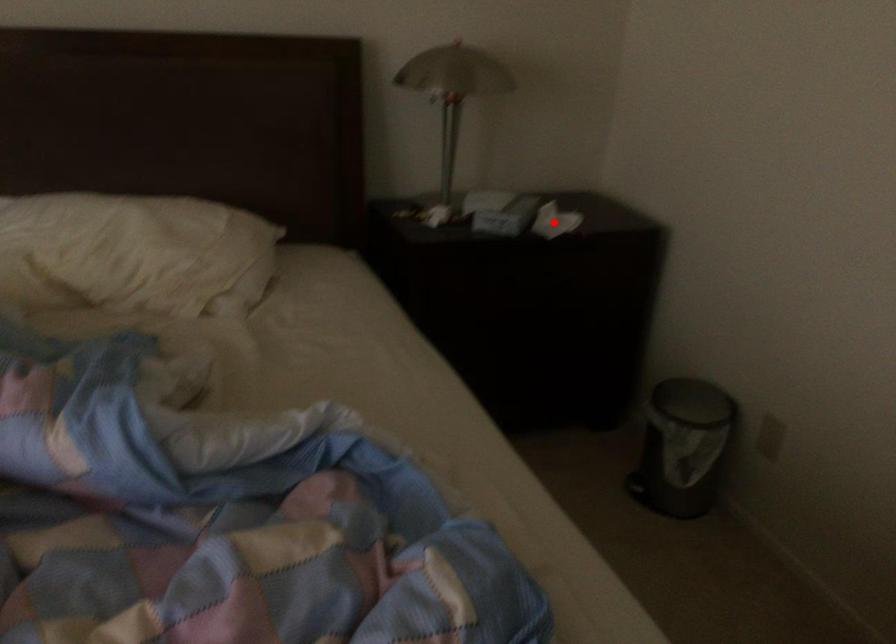
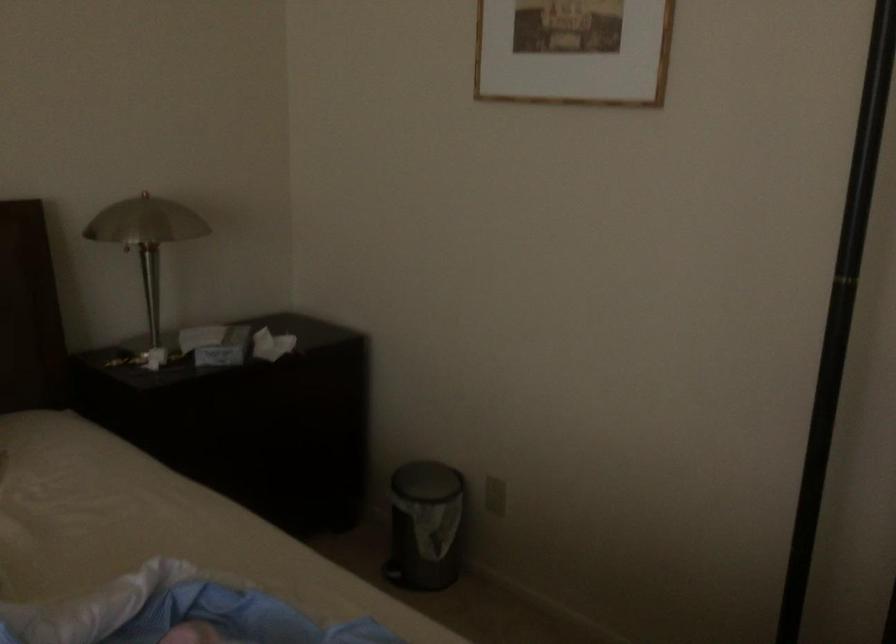
Where in the second image is the point corresponding to the highlighted location from the first image?

(271, 345)